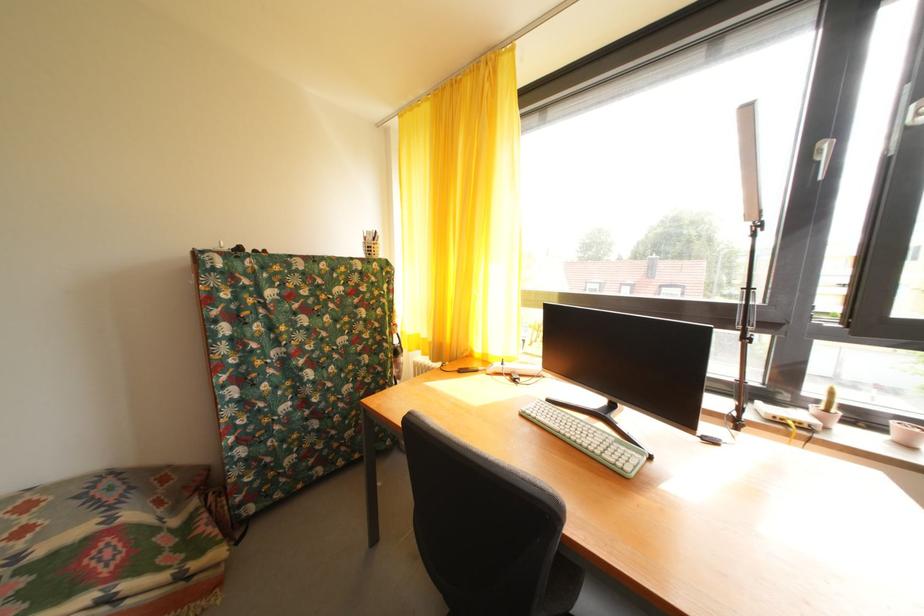
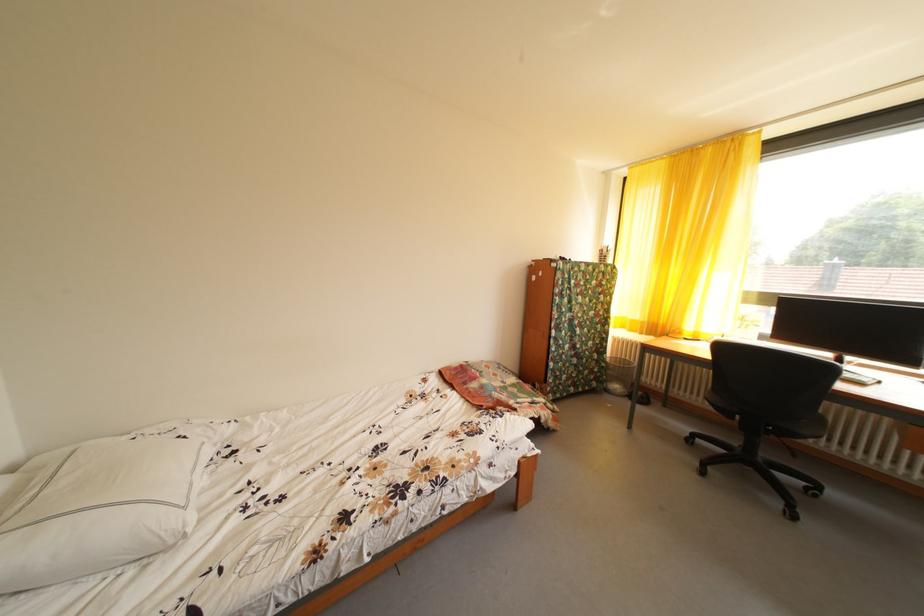
The images are taken continuously from a first-person perspective. In which direction are you moving?

The cameraman moved toward left, backward.